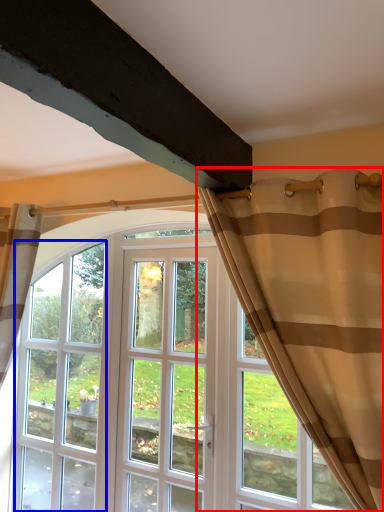
Question: Which of the following is the farthest to the observer, curtain (highlighted by a red box) or window (highlighted by a blue box)?

Choices:
 (A) curtain
 (B) window

Answer: (B)